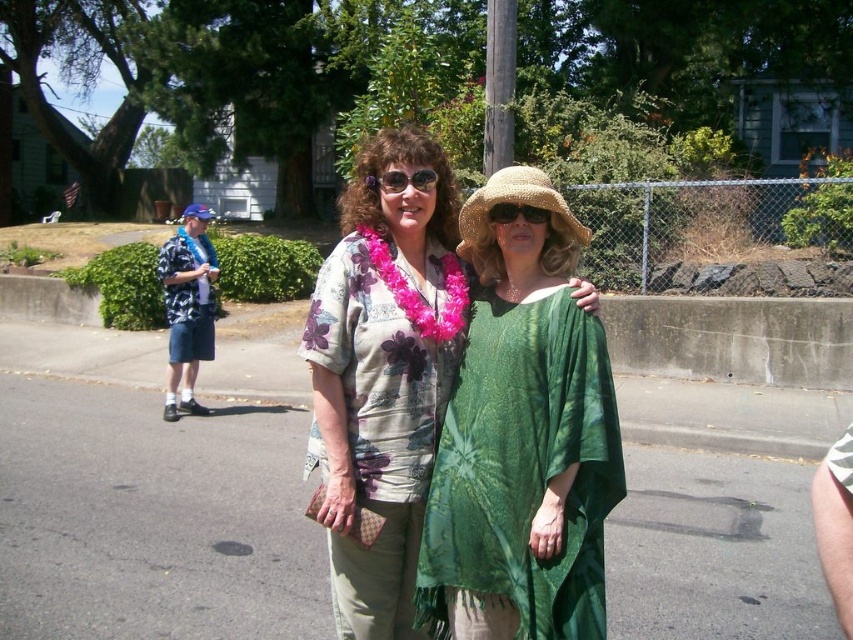
You are a photographer trying to capture both the hawaiian print fabric shirt at left and the sunglassesbrown at center in a single shot. However, your camera can only focus on one object at a time. Which object should you focus on first to ensure the other remains in the frame?

The sunglassesbrown at center is behind the hawaiian print fabric shirt at left, so you should focus on the sunglassesbrown at center first to ensure the hawaiian print fabric shirt at left stays in the frame.

You are a photographer trying to capture a closeup of the floral print blouse at center and the matte black sunglasses at center. Based on their sizes, which object should you focus on first to ensure both are in frame without zooming in too much?

The floral print blouse at center has a larger size compared to matte black sunglasses at center, so you should focus on the floral print blouse at center first to ensure both fit in the frame without excessive zooming.